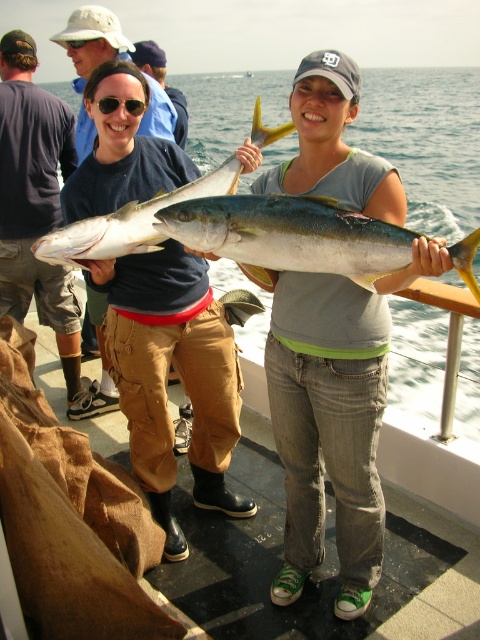
You are standing on the boat and want to hand the matte yellow fish at center to someone behind you. The person behind you is 1.5 meters away from you. Can you reach them without moving? Please explain.

The matte yellow fish at center is 1.63 meters away from the viewer. Since the person behind you is only 1.5 meters away, you can reach them by extending your arm as the distance is shorter than the distance to the fish.

You are standing on the boat and want to reach the point at coordinates point (436, 240). If you can stretch your arm 1.5 meters, will you be able to touch that point?

The point at point (436, 240) is 1.78 meters away from you, so stretching your arm 1.5 meters won

You are a photographer on the boat and want to capture both the matte blue shirt at center and the yellow shiny fish at center in the same frame. Given their sizes, which one will appear bigger in the photo?

The matte blue shirt at center will appear bigger in the photo since it has a larger size compared to the yellow shiny fish at center.